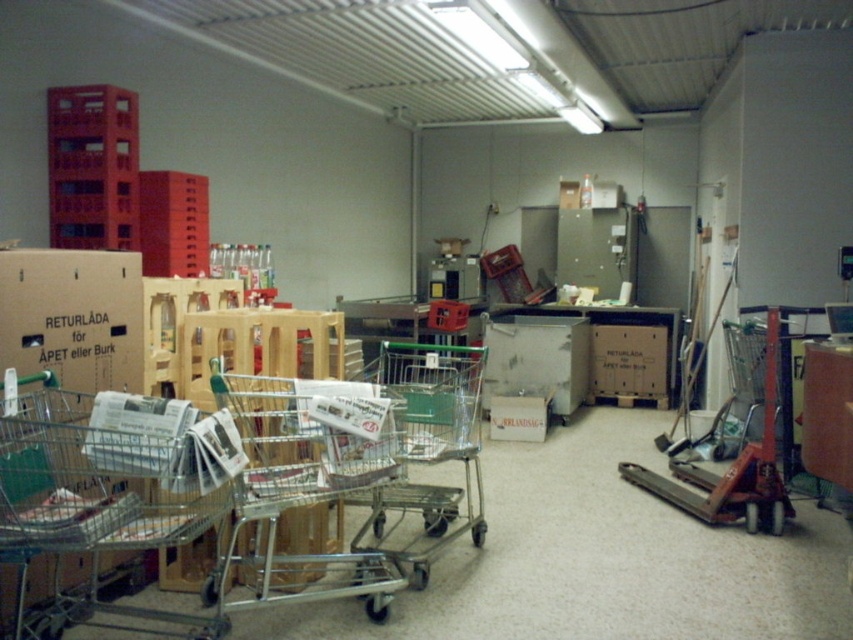
In the scene shown: You are a delivery person who needs to move a large box through the storage area. You see the metallic silver shopping cart at left and the orange metallic trolley at center right. Which one has a wider space between its wheels to accommodate the box?

The metallic silver shopping cart at left has a wider space between its wheels than the orange metallic trolley at center right because its width surpasses the trolley.

You are a worker in the storage area and need to move the metallic silver shopping cart at left and the silver metallic shopping cart at center to a different location. If you can only carry one cart at a time, which cart would be easier to move due to its size?

The metallic silver shopping cart at left is smaller than the silver metallic shopping cart at center, so it would be easier to move.